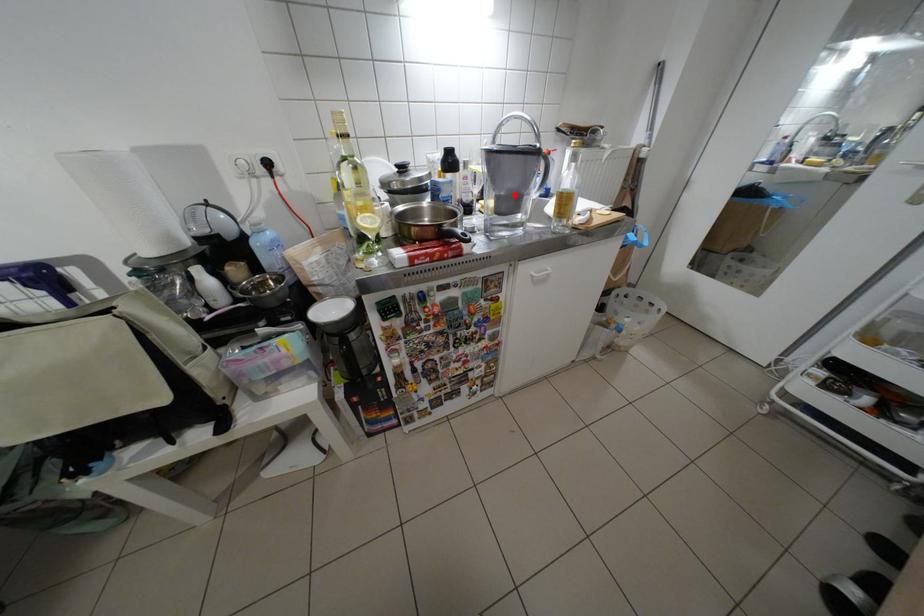
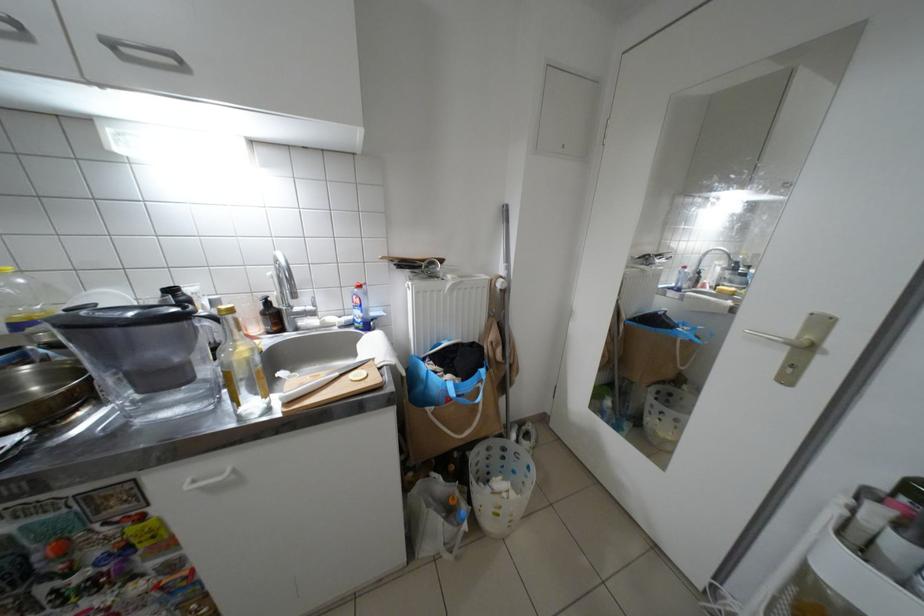
Locate, in the second image, the point that corresponds to the highlighted location in the first image.

(139, 369)